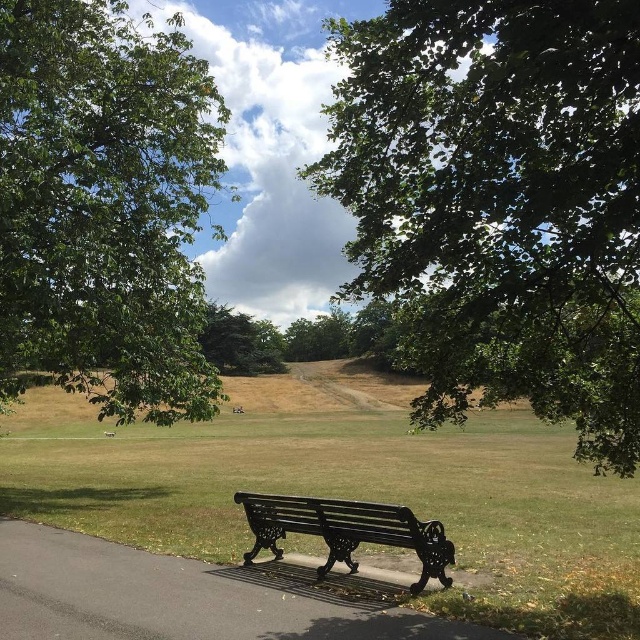
Does green leafy tree at upper right have a greater width compared to black cast iron bench at lower center?

Yes, green leafy tree at upper right is wider than black cast iron bench at lower center.

Who is positioned more to the right, green leafy tree at upper right or black cast iron bench at lower center?

green leafy tree at upper right is more to the right.

Who is more distant from viewer, (396, 67) or (305, 513)?

Positioned behind is point (305, 513).

This screenshot has height=640, width=640. I want to click on green leafy tree at upper right, so click(500, 202).

Is black metal bench at center positioned behind black cast iron bench at lower center?

Yes, it is.

Is point (129, 627) in front of point (342, 531)?

Yes, point (129, 627) is closer to viewer.

I want to click on black metal bench at center, so click(186, 596).

Is black metal bench at center taller than green textured tree at center?

In fact, black metal bench at center may be shorter than green textured tree at center.

Between black metal bench at center and green textured tree at center, which one has less height?

black metal bench at center

Who is more distant from viewer, [403,588] or [221,346]?

The point [221,346] is more distant.

The width and height of the screenshot is (640, 640). Find the location of `black metal bench at center`. black metal bench at center is located at coordinates (186, 596).